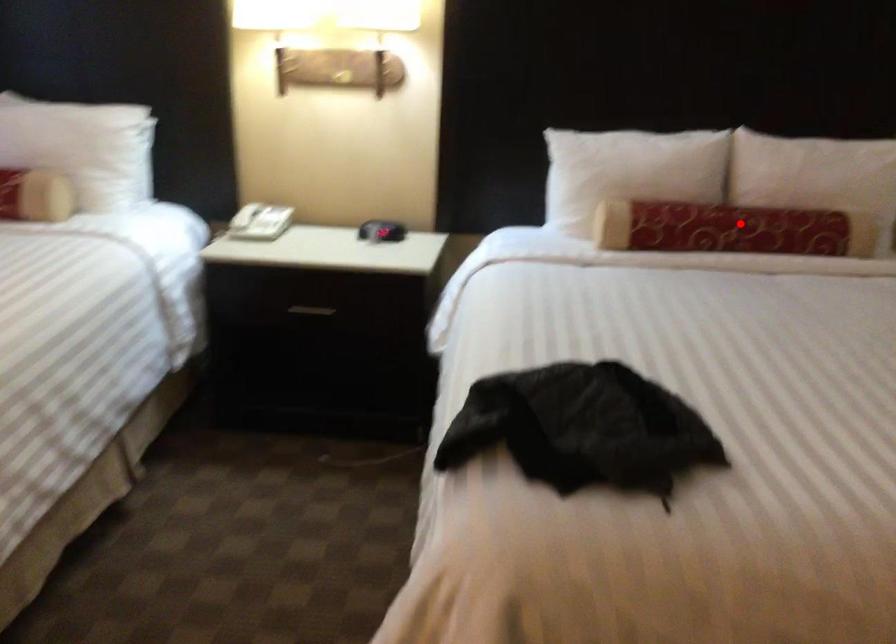
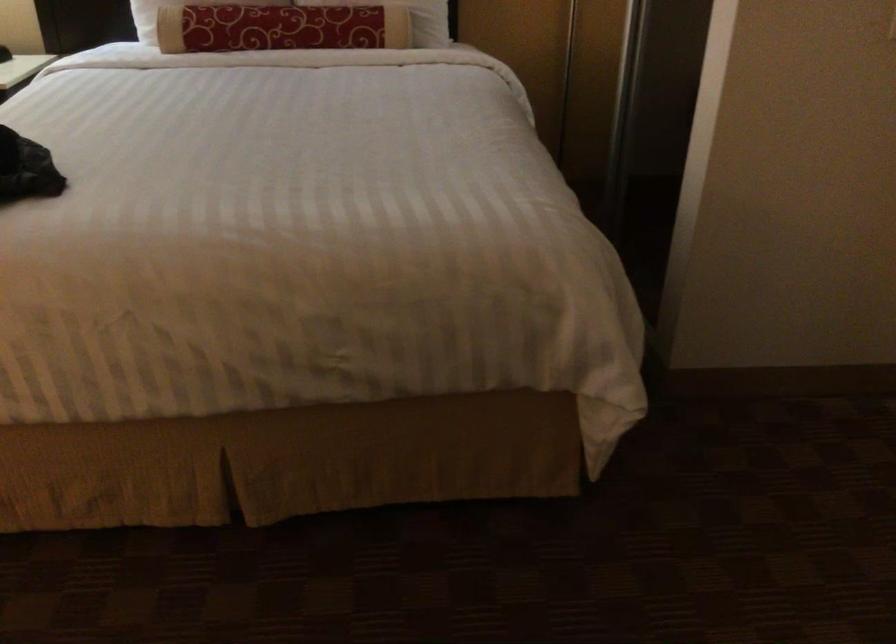
Question: A red point is marked in image1. In image2, is the corresponding 3D point closer to the camera or farther? Reply with the corresponding letter.

Choices:
 (A) The corresponding 3D point is closer.
 (B) The corresponding 3D point is farther.

Answer: (B)